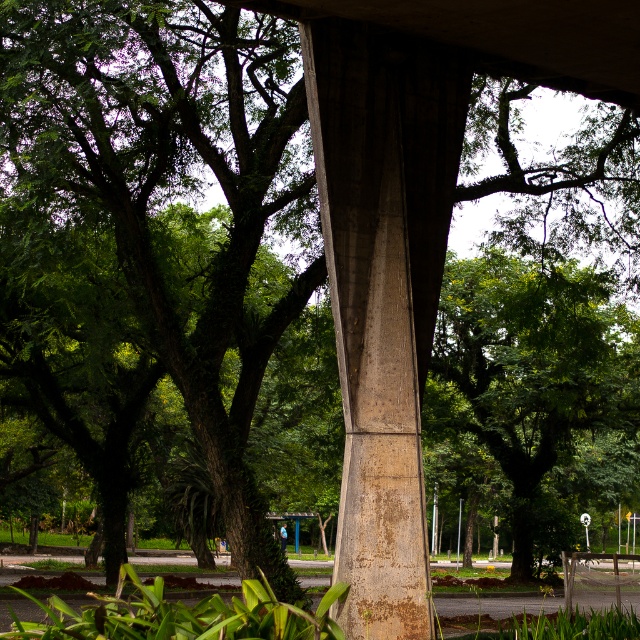
Question: Which point appears farthest from the camera in this image?

Choices:
 (A) (364, 259)
 (B) (586, 404)
 (C) (604, 97)

Answer: (B)

Question: Does green leafy tree at center have a greater width compared to rusty concrete pillar at center?

Choices:
 (A) no
 (B) yes

Answer: (B)

Question: Which of the following is the closest to the observer?

Choices:
 (A) green leafy tree at center
 (B) concrete at center
 (C) rusty concrete pillar at center

Answer: (B)

Question: Is green leafy tree at center smaller than rusty concrete pillar at center?

Choices:
 (A) yes
 (B) no

Answer: (B)

Question: Which is nearer to the rusty concrete pillar at center?

Choices:
 (A) green leafy tree at center
 (B) concrete at center

Answer: (B)

Question: Is the position of green leafy tree at center more distant than that of rusty concrete pillar at center?

Choices:
 (A) yes
 (B) no

Answer: (A)